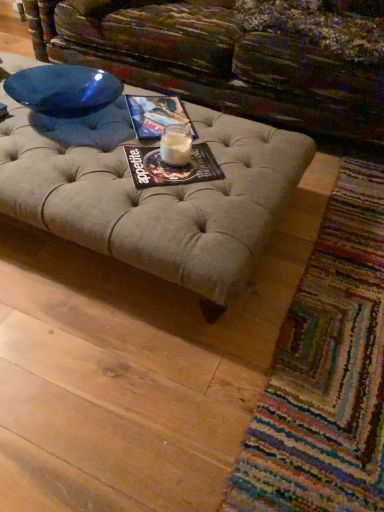
The height and width of the screenshot is (512, 384). What are the coordinates of `blank space situated above matte paper magazine at center, arranged as the 2th magazine when viewed from the back (from a real-world perspective)` in the screenshot? It's located at tap(169, 152).